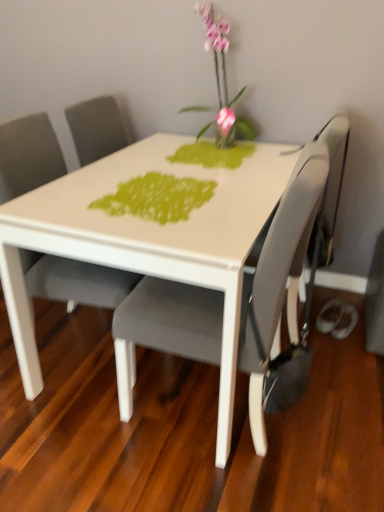
Question: From a real-world perspective, relative to matte gray chair at center, arranged as the 2th chair when viewed from the right, is green textured placemat at center vertically above or below?

Choices:
 (A) above
 (B) below

Answer: (A)

Question: Visually, is green textured placemat at center positioned to the left or to the right of matte gray chair at center, arranged as the 2th chair when viewed from the right?

Choices:
 (A) right
 (B) left

Answer: (A)

Question: Which object is the farthest from the matte gray chair at center, acting as the first chair starting from the right?

Choices:
 (A) matte gray chair at center, the first chair in the left-to-right sequence
 (B) green textured placemat at center
 (C) matte gray swivel chair at right
 (D) pink glass vase at upper center

Answer: (D)

Question: Estimate the real-world distances between objects in this image. Which object is farther from the green textured placemat at center?

Choices:
 (A) pink glass vase at upper center
 (B) matte gray chair at center, the first chair in the left-to-right sequence
 (C) matte gray swivel chair at right
 (D) matte gray chair at center, the 2th chair viewed from the left

Answer: (A)